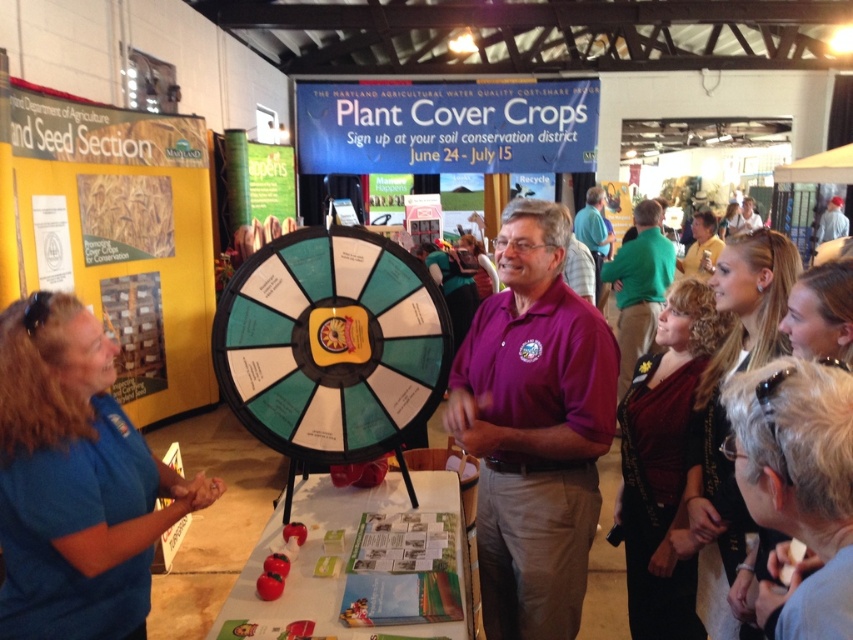
Which of these two, purple cotton shirt at center or blue fabric shirt at lower left, stands taller?

Standing taller between the two is purple cotton shirt at center.

Is point (575, 621) closer to viewer compared to point (78, 310)?

No, it is not.

Find the location of `purple cotton shirt at center`. purple cotton shirt at center is located at coordinates (534, 428).

Can you confirm if teal plastic wheel at center is positioned above gray fur at lower right?

Indeed, teal plastic wheel at center is positioned over gray fur at lower right.

Between teal plastic wheel at center and gray fur at lower right, which one has more height?

With more height is teal plastic wheel at center.

Between point (303, 404) and point (790, 600), which one is positioned behind?

Point (303, 404)

Where is `teal plastic wheel at center`? The height and width of the screenshot is (640, 853). teal plastic wheel at center is located at coordinates (331, 344).

Does purple cotton shirt at center have a lesser width compared to teal plastic wheel at center?

Correct, purple cotton shirt at center's width is less than teal plastic wheel at center's.

Between point (564, 528) and point (378, 356), which one is positioned in front?

Point (564, 528)

Find the location of `purple cotton shirt at center`. purple cotton shirt at center is located at coordinates (534, 428).